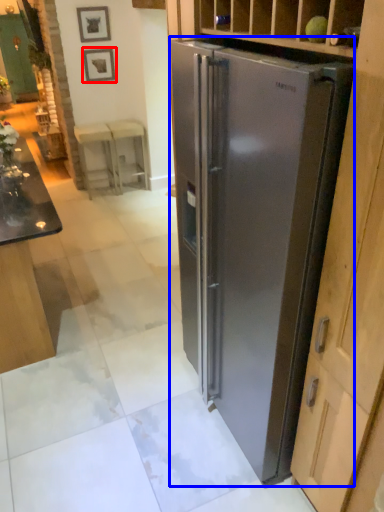
Question: Which of the following is the closest to the observer, picture frame (highlighted by a red box) or refrigerator (highlighted by a blue box)?

Choices:
 (A) picture frame
 (B) refrigerator

Answer: (B)